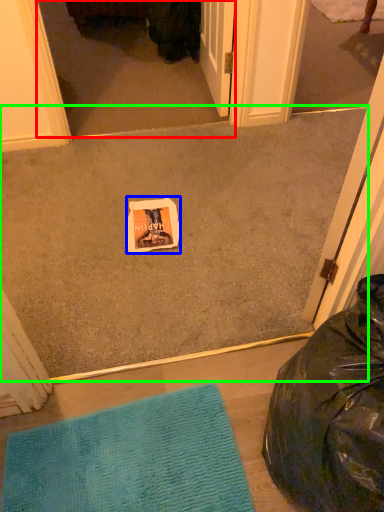
Question: Which object is positioned closest to screen door (highlighted by a red box)? Select from postcard (highlighted by a blue box) and concrete (highlighted by a green box).

Choices:
 (A) postcard
 (B) concrete

Answer: (B)